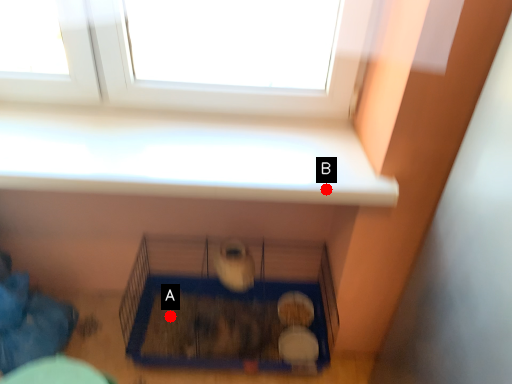
Question: Two points are circled on the image, labeled by A and B beside each circle. Which point is closer to the camera taking this photo?

Choices:
 (A) A is closer
 (B) B is closer

Answer: (B)